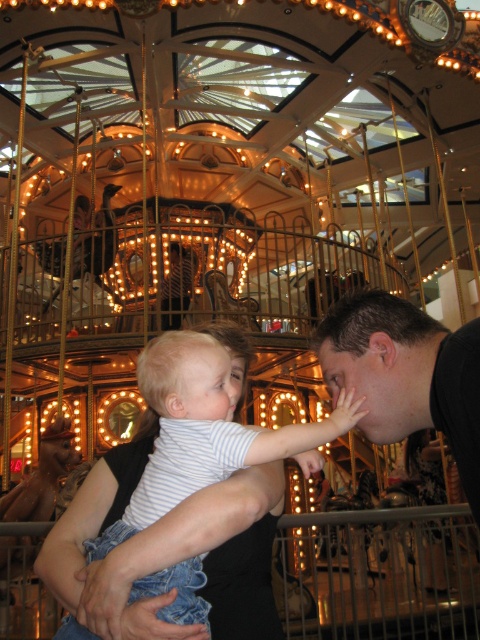
In the scene shown: You are designing a gift shop for the carousel and need to place two shirts on a display rack. The black matte shirt at center and the striped cotton shirt at center must be arranged so that the smaller one is placed above the larger one. Which shirt should go on top?

The black matte shirt at center has a smaller size compared to striped cotton shirt at center, so it should be placed above the striped cotton shirt at center on the display rack.

You are standing at the center of the carousel and see two points marked in the image. Which point, point (409, 416) or point (212, 572), is closer to you?

Point (212, 572) is closer to you because it is in front of point (409, 416).

You are standing in the center of the carousel and want to locate the black matte shirt at center. According to the coordinates provided, in which direction should you look to find it?

You should look towards the coordinates point at 0.586 on the x axis and 0.846 on the y axis to find the black matte shirt at center.